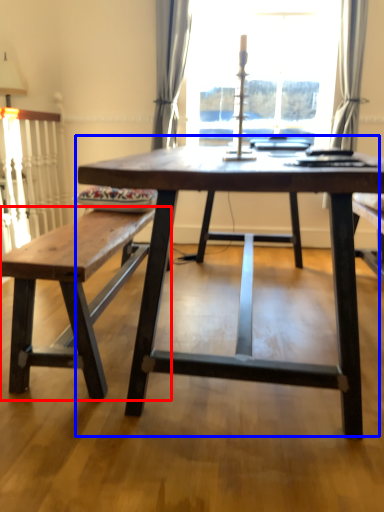
Question: Which object is closer to the camera taking this photo, table (highlighted by a red box) or coffee table (highlighted by a blue box)?

Choices:
 (A) table
 (B) coffee table

Answer: (B)